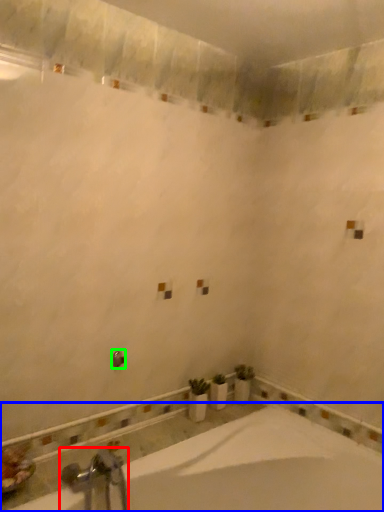
Question: Estimate the real-world distances between objects in this image. Which object is closer to tap (highlighted by a red box), bathtub (highlighted by a blue box) or shower (highlighted by a green box)?

Choices:
 (A) bathtub
 (B) shower

Answer: (A)